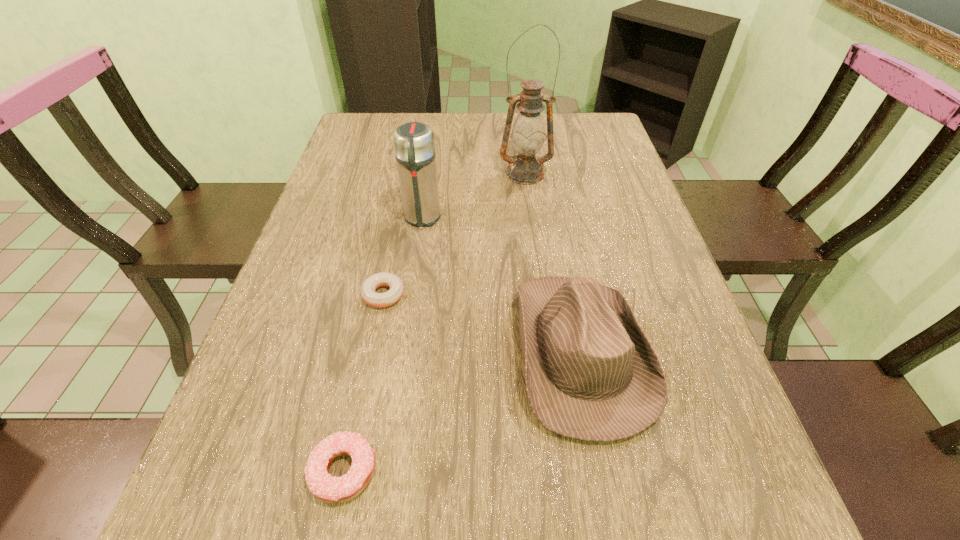
This screenshot has height=540, width=960. Identify the location of the farthest object. (528, 135).

Find the location of a particular element. the tallest object is located at coordinates (528, 135).

In order to click on the second tallest object in this screenshot , I will do `click(414, 145)`.

I want to click on the second farthest object, so click(414, 145).

Where is `the third shortest object`? The height and width of the screenshot is (540, 960). the third shortest object is located at coordinates (592, 374).

Where is `the nearer doughnut`? the nearer doughnut is located at coordinates tap(326, 488).

Where is `the second shortest object`? the second shortest object is located at coordinates (326, 488).

At what (x,y) coordinates should I click in order to perform the action: click on the shortest object. Please return your answer as a coordinate pair (x, y). This screenshot has width=960, height=540. Looking at the image, I should click on (379, 300).

Identify the location of the shorter doughnut. This screenshot has height=540, width=960. (379, 300).

I want to click on blank space located on the back of the farthest object, so coord(520,137).